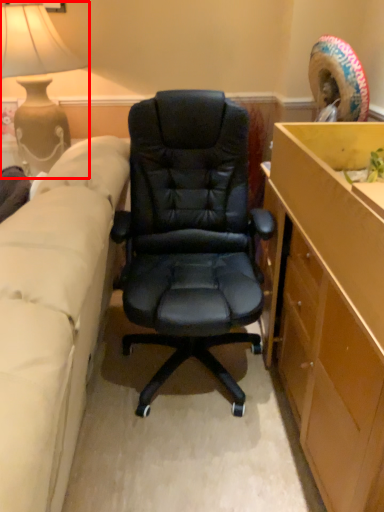
Question: Where is lamp (annotated by the red box) located in relation to studio couch in the image?

Choices:
 (A) left
 (B) right

Answer: (A)